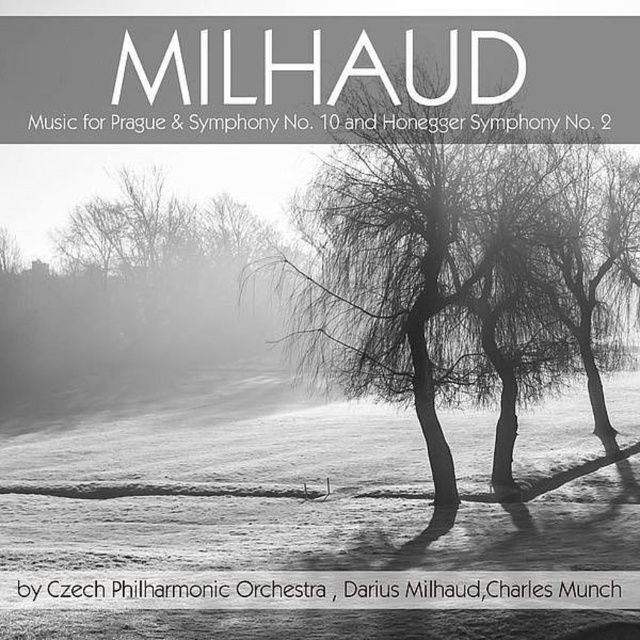
Question: Among these points, which one is farthest from the camera?

Choices:
 (A) (147, 212)
 (B) (305, 317)
 (C) (305, 477)

Answer: (A)

Question: Does white powder snow at center appear on the right side of smooth bark tree at center?

Choices:
 (A) yes
 (B) no

Answer: (B)

Question: Which object is positioned closest to the smooth bark tree at center?

Choices:
 (A) silvery bark tree at center
 (B) white powder snow at center

Answer: (B)

Question: Can you confirm if white powder snow at center is bigger than silvery bark tree at center?

Choices:
 (A) no
 (B) yes

Answer: (A)

Question: Does white powder snow at center have a larger size compared to smooth bark tree at center?

Choices:
 (A) no
 (B) yes

Answer: (B)

Question: Which of the following is the closest to the observer?

Choices:
 (A) (545, 376)
 (B) (99, 417)

Answer: (A)